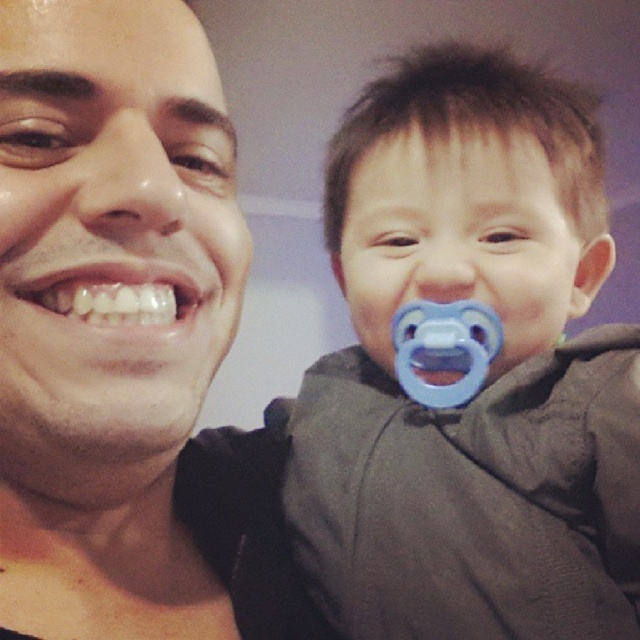
Does matte black face at left have a larger size compared to white glossy teeth at center?

Indeed, matte black face at left has a larger size compared to white glossy teeth at center.

Who is positioned more to the left, matte black face at left or white glossy teeth at center?

matte black face at left is more to the left.

Does point (225, 451) lie behind point (86, 284)?

Yes, it is.

Where is `matte black face at left`? The width and height of the screenshot is (640, 640). matte black face at left is located at coordinates (125, 339).

What do you see at coordinates (486, 376) in the screenshot? I see `blue rubber pacifier at upper right` at bounding box center [486, 376].

Find the location of a particular element. The width and height of the screenshot is (640, 640). blue rubber pacifier at upper right is located at coordinates (486, 376).

Does blue rubber pacifier at upper right appear over matte black face at left?

Correct, blue rubber pacifier at upper right is located above matte black face at left.

Between point (424, 236) and point (84, 524), which one is positioned behind?

Point (424, 236)

Describe the element at coordinates (486, 376) in the screenshot. Image resolution: width=640 pixels, height=640 pixels. I see `blue rubber pacifier at upper right` at that location.

Identify the location of blue rubber pacifier at upper right. (486, 376).